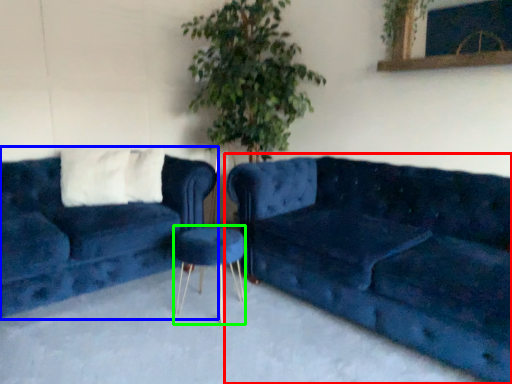
Question: Which object is positioned closest to studio couch (highlighted by a red box)? Select from studio couch (highlighted by a blue box) and bar stool (highlighted by a green box).

Choices:
 (A) studio couch
 (B) bar stool

Answer: (B)